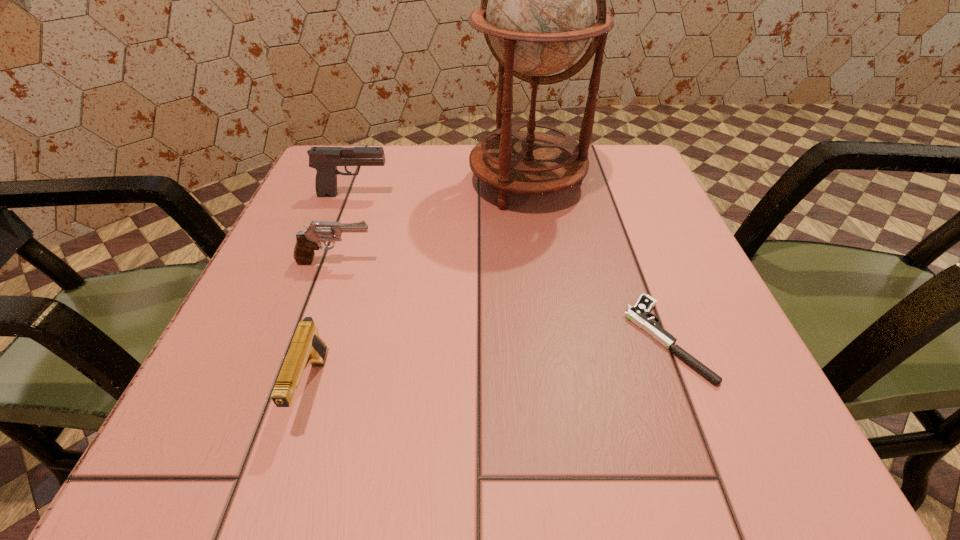
I want to click on the tallest object, so click(x=538, y=8).

Where is `the second tallest object`? The height and width of the screenshot is (540, 960). the second tallest object is located at coordinates (325, 160).

Find the location of a particular element. the tallest pistol is located at coordinates (325, 160).

Locate an element on the screen. The height and width of the screenshot is (540, 960). the third nearest object is located at coordinates (307, 241).

Identify the location of the shortest pistol. (639, 314).

You are a GUI agent. You are given a task and a screenshot of the screen. Output one action in this format:
    pyautogui.click(x=<x>, y=<y>)
    Task: Click on the rightmost pistol
    The image size is (960, 540).
    Given the screenshot: What is the action you would take?
    pyautogui.click(x=639, y=314)

At what (x,y) coordinates should I click in order to perform the action: click on free point located 0.250m on the surface of the tallest object. Please return your answer as a coordinate pair (x, y). The width and height of the screenshot is (960, 540). Looking at the image, I should click on click(545, 314).

At what (x,y) coordinates should I click in order to perform the action: click on vacant position located aim along the barrel of the tallest pistol. Please return your answer as a coordinate pair (x, y). The height and width of the screenshot is (540, 960). Looking at the image, I should click on (459, 194).

You are a GUI agent. You are given a task and a screenshot of the screen. Output one action in this format:
    pyautogui.click(x=<x>, y=<y>)
    Task: Click on the free region located at the barrel of the third nearest object
    This screenshot has height=540, width=960.
    Given the screenshot: What is the action you would take?
    pyautogui.click(x=526, y=261)

Identify the location of free space located on the front-facing side of the shortest pistol. The height and width of the screenshot is (540, 960). (575, 339).